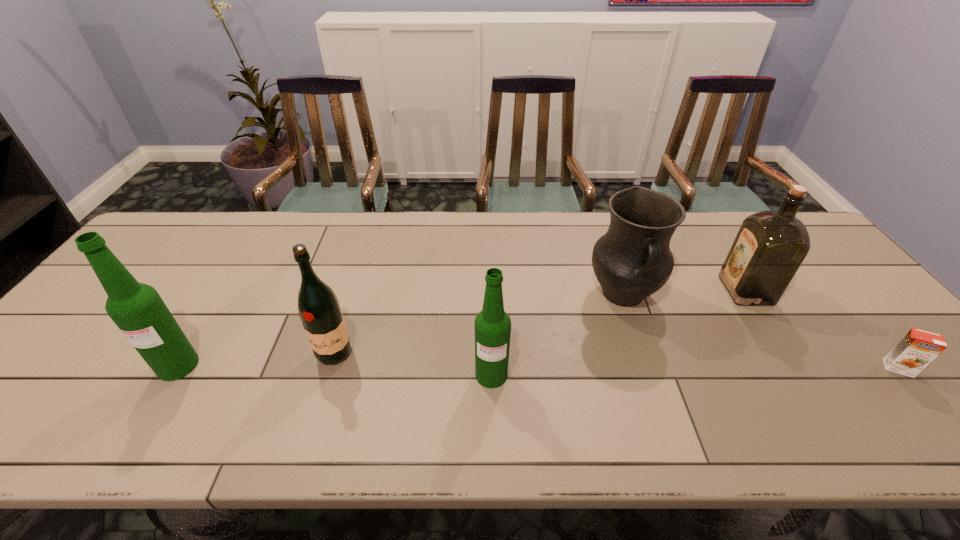
Locate an element on the screen. orange juice is located at coordinates (917, 349).

You are a GUI agent. You are given a task and a screenshot of the screen. Output one action in this format:
    pyautogui.click(x=<x>, y=<y>)
    Task: Click on the free space located 0.050m on the label of the left beer bottle
    
    Given the screenshot: What is the action you would take?
    pyautogui.click(x=156, y=401)

Image resolution: width=960 pixels, height=540 pixels. What are the coordinates of `free space located 0.050m on the handle side of the pitcher` in the screenshot? It's located at (638, 340).

Where is `free space located 0.080m on the label of the second object from right to left`? This screenshot has width=960, height=540. free space located 0.080m on the label of the second object from right to left is located at coordinates (696, 290).

The height and width of the screenshot is (540, 960). I want to click on vacant region located on the label of the second object from right to left, so click(x=664, y=290).

Where is `free space located on the label of the second object from right to left`? The width and height of the screenshot is (960, 540). free space located on the label of the second object from right to left is located at coordinates (595, 290).

Identify the location of free region located on the left of the orange juice. (803, 368).

This screenshot has width=960, height=540. Identify the location of orange juice present at the near edge. (917, 349).

Image resolution: width=960 pixels, height=540 pixels. I want to click on object present at the right edge, so click(917, 349).

This screenshot has width=960, height=540. I want to click on object positioned at the near right corner, so click(x=917, y=349).